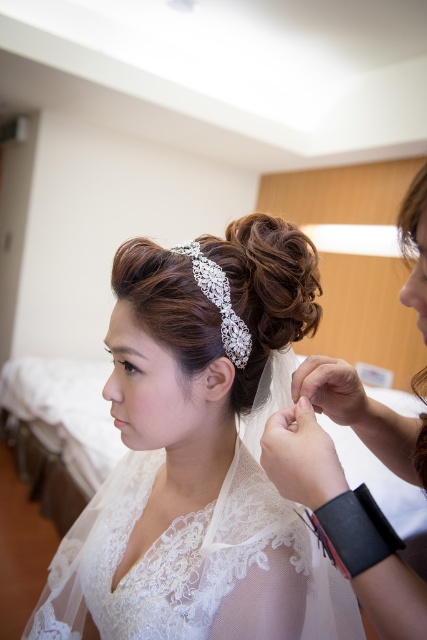
You are a photographer trying to capture a close shot of the bride. The camera lens can only focus on objects within a 10 inch range. Given the lace fabric wedding dress at center and the clear crystal headband at center, will both be in focus?

The distance between the lace fabric wedding dress at center and the clear crystal headband at center is 10.40 inches, which exceeds the camera lens focus range of 10 inches. Therefore, both objects cannot be in focus simultaneously.

You are a photographer positioned to capture the bride getting ready. You notice the white lace veil at upper center and the lace fabric wedding dress at center. Which object is closer to the camera?

The white lace veil at upper center is closer to the camera as it is positioned in front of the lace fabric wedding dress at center.

The bride is adjusting her veil while standing in front of a full length mirror. Can she see the white lace veil at upper center in the mirror if she looks down at the lace fabric wedding dress at center?

Yes, the bride can see the white lace veil at upper center in the mirror because it is located above the lace fabric wedding dress at center, so when she looks down at the dress, the veil would be reflected above it in the mirror.